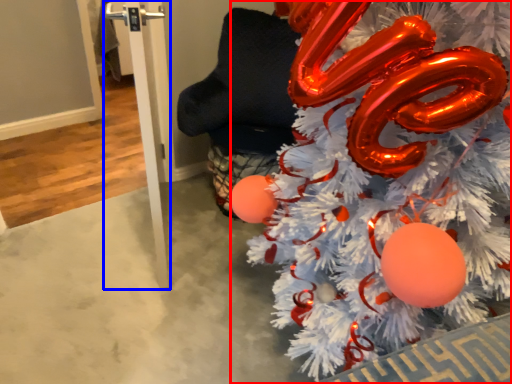
Question: Among these objects, which one is nearest to the camera, christmas tree (highlighted by a red box) or pole (highlighted by a blue box)?

Choices:
 (A) christmas tree
 (B) pole

Answer: (A)